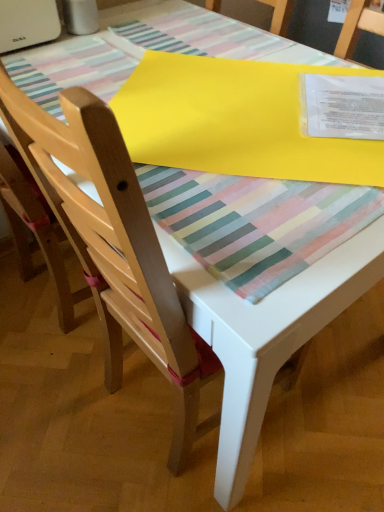
Consider the image. What is the approximate height of light wood chair at left, which is counted as the second chair, starting from the right?

38.02 inches.

Find the location of a particular element. The image size is (384, 512). yellow matte paper at upper center is located at coordinates (236, 121).

What do you see at coordinates (116, 246) in the screenshot? I see `matte wood chair at center, which is the first chair in right-to-left order` at bounding box center [116, 246].

Locate an element on the screen. light wood chair at left, which is counted as the first chair, starting from the left is located at coordinates (65, 228).

Considering the sizes of objects yellow matte paper at upper center and matte wood chair at center, which is the first chair in right-to-left order, in the image provided, who is smaller, yellow matte paper at upper center or matte wood chair at center, which is the first chair in right-to-left order,?

yellow matte paper at upper center is smaller.

From the image's perspective, which one is positioned lower, yellow matte paper at upper center or matte wood chair at center, the second chair in the left-to-right sequence?

matte wood chair at center, the second chair in the left-to-right sequence.

How many degrees apart are the facing directions of yellow matte paper at upper center and matte wood chair at center, the second chair in the left-to-right sequence?

They differ by 50.7 degrees in their facing directions.

The height and width of the screenshot is (512, 384). Find the location of `the 2nd chair in front of the yellow matte paper at upper center`. the 2nd chair in front of the yellow matte paper at upper center is located at coordinates (116, 246).

Considering the relative sizes of light wood chair at left, which is counted as the second chair, starting from the right, and yellow matte paper at upper center in the image provided, is light wood chair at left, which is counted as the second chair, starting from the right, thinner than yellow matte paper at upper center?

Yes.

Considering the relative sizes of light wood chair at left, which is counted as the second chair, starting from the right, and yellow matte paper at upper center in the image provided, is light wood chair at left, which is counted as the second chair, starting from the right, shorter than yellow matte paper at upper center?

No, light wood chair at left, which is counted as the second chair, starting from the right, is not shorter than yellow matte paper at upper center.

Is light wood chair at left, which is counted as the second chair, starting from the right, facing away from yellow matte paper at upper center?

That's not correct — light wood chair at left, which is counted as the second chair, starting from the right, is not looking away from yellow matte paper at upper center.

How much distance is there between yellow matte paper at upper center and light wood chair at left, which is counted as the first chair, starting from the left?

The distance of yellow matte paper at upper center from light wood chair at left, which is counted as the first chair, starting from the left, is 15.28 inches.

Is yellow matte paper at upper center inside or outside of light wood chair at left, which is counted as the second chair, starting from the right?

yellow matte paper at upper center cannot be found inside light wood chair at left, which is counted as the second chair, starting from the right.

Can you see yellow matte paper at upper center touching light wood chair at left, which is counted as the second chair, starting from the right?

yellow matte paper at upper center and light wood chair at left, which is counted as the second chair, starting from the right, are clearly separated.

Can you tell me how much yellow matte paper at upper center and light wood chair at left, which is counted as the first chair, starting from the left, differ in facing direction?

yellow matte paper at upper center and light wood chair at left, which is counted as the first chair, starting from the left, are facing 50.7 degrees away from each other.

At what (x,y) coordinates should I click in order to perform the action: click on chair located above the matte wood chair at center, which is the first chair in right-to-left order (from the image's perspective). Please return your answer as a coordinate pair (x, y). Looking at the image, I should click on pyautogui.click(x=65, y=228).

Which is correct: matte wood chair at center, which is the first chair in right-to-left order, is inside light wood chair at left, which is counted as the first chair, starting from the left, or outside of it?

matte wood chair at center, which is the first chair in right-to-left order, cannot be found inside light wood chair at left, which is counted as the first chair, starting from the left.

Are matte wood chair at center, which is the first chair in right-to-left order, and light wood chair at left, which is counted as the first chair, starting from the left, beside each other?

No, matte wood chair at center, which is the first chair in right-to-left order, is not making contact with light wood chair at left, which is counted as the first chair, starting from the left.

Does matte wood chair at center, which is the first chair in right-to-left order, come in front of light wood chair at left, which is counted as the first chair, starting from the left?

Yes, matte wood chair at center, which is the first chair in right-to-left order, is in front of light wood chair at left, which is counted as the first chair, starting from the left.

What's the angular difference between matte wood chair at center, which is the first chair in right-to-left order, and yellow matte paper at upper center's facing directions?

They differ by 50.7 degrees in their facing directions.

Is matte wood chair at center, the second chair in the left-to-right sequence, positioned behind yellow matte paper at upper center?

No, matte wood chair at center, the second chair in the left-to-right sequence, is in front of yellow matte paper at upper center.

Considering the relative sizes of matte wood chair at center, the second chair in the left-to-right sequence, and yellow matte paper at upper center in the image provided, is matte wood chair at center, the second chair in the left-to-right sequence, thinner than yellow matte paper at upper center?

No.

Find the location of a particular element. This screenshot has width=384, height=512. chair to the right of light wood chair at left, which is counted as the second chair, starting from the right is located at coordinates (116, 246).

Does light wood chair at left, which is counted as the second chair, starting from the right, have a smaller size compared to matte wood chair at center, the second chair in the left-to-right sequence?

Indeed, light wood chair at left, which is counted as the second chair, starting from the right, has a smaller size compared to matte wood chair at center, the second chair in the left-to-right sequence.

In the scene shown: Considering the sizes of light wood chair at left, which is counted as the first chair, starting from the left, and matte wood chair at center, which is the first chair in right-to-left order, in the image, is light wood chair at left, which is counted as the first chair, starting from the left, taller or shorter than matte wood chair at center, which is the first chair in right-to-left order,?

light wood chair at left, which is counted as the first chair, starting from the left, is taller than matte wood chair at center, which is the first chair in right-to-left order.

Is light wood chair at left, which is counted as the second chair, starting from the right, facing towards matte wood chair at center, which is the first chair in right-to-left order?

Yes, light wood chair at left, which is counted as the second chair, starting from the right, faces towards matte wood chair at center, which is the first chair in right-to-left order.

From a real-world perspective, starting from the yellow matte paper at upper center, which chair is the 2nd one below it? Please provide its 2D coordinates.

[(116, 246)]

Which chair is the 2nd one when counting from the left side of the yellow matte paper at upper center? Please provide its 2D coordinates.

[(65, 228)]

Estimate the real-world distances between objects in this image. Which object is closer to yellow matte paper at upper center, light wood chair at left, which is counted as the first chair, starting from the left, or matte wood chair at center, which is the first chair in right-to-left order?

Based on the image, matte wood chair at center, which is the first chair in right-to-left order, appears to be nearer to yellow matte paper at upper center.

Estimate the real-world distances between objects in this image. Which object is further from matte wood chair at center, which is the first chair in right-to-left order, light wood chair at left, which is counted as the first chair, starting from the left, or yellow matte paper at upper center?

yellow matte paper at upper center is further to matte wood chair at center, which is the first chair in right-to-left order.

From the image, which object appears to be farther from matte wood chair at center, the second chair in the left-to-right sequence, yellow matte paper at upper center or light wood chair at left, which is counted as the second chair, starting from the right?

yellow matte paper at upper center lies further to matte wood chair at center, the second chair in the left-to-right sequence, than the other object.

From the image, which object appears to be nearer to light wood chair at left, which is counted as the first chair, starting from the left, yellow matte paper at upper center or matte wood chair at center, which is the first chair in right-to-left order?

matte wood chair at center, which is the first chair in right-to-left order.

Looking at the image, which one is located closer to yellow matte paper at upper center, matte wood chair at center, the second chair in the left-to-right sequence, or light wood chair at left, which is counted as the first chair, starting from the left?

matte wood chair at center, the second chair in the left-to-right sequence, is closer to yellow matte paper at upper center.

Which object lies nearer to the anchor point light wood chair at left, which is counted as the second chair, starting from the right, matte wood chair at center, which is the first chair in right-to-left order, or yellow matte paper at upper center?

The object closer to light wood chair at left, which is counted as the second chair, starting from the right, is matte wood chair at center, which is the first chair in right-to-left order.

Image resolution: width=384 pixels, height=512 pixels. I want to click on chair between light wood chair at left, which is counted as the second chair, starting from the right, and yellow matte paper at upper center, in the horizontal direction, so click(x=116, y=246).